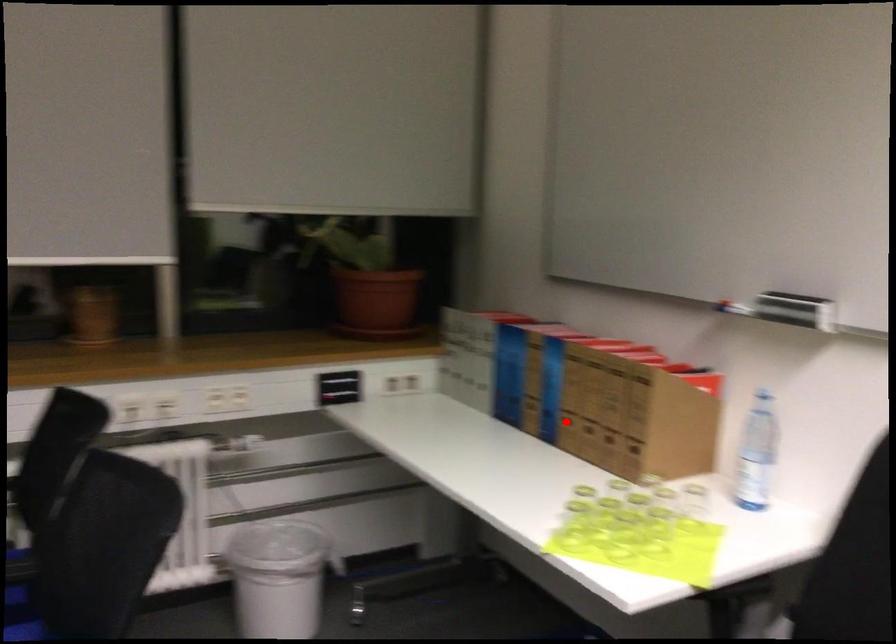
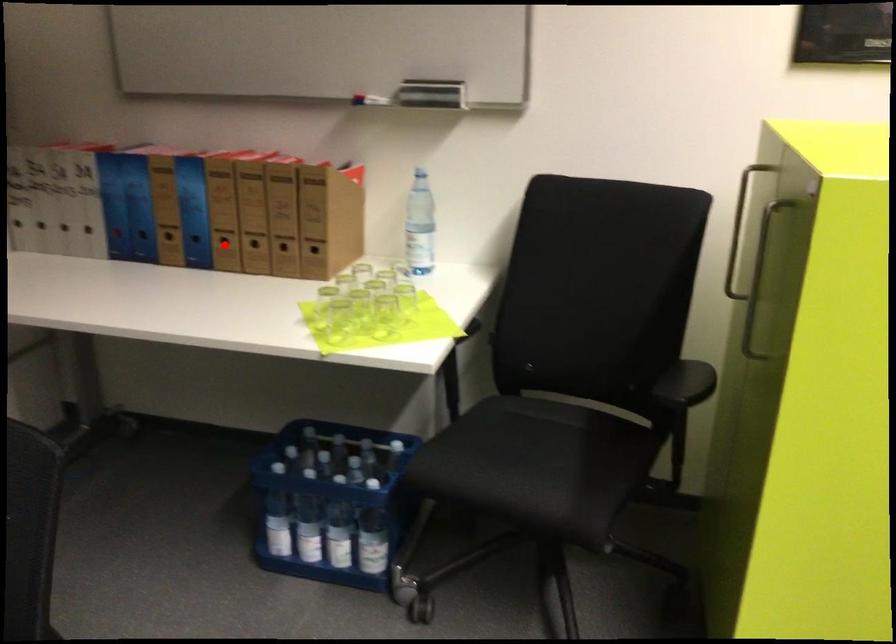
I am providing you with two images of the same scene from different viewpoints. A red point is marked on the first image and another point is marked on the second image. Do the highlighted points in image1 and image2 indicate the same real-world spot?

Yes